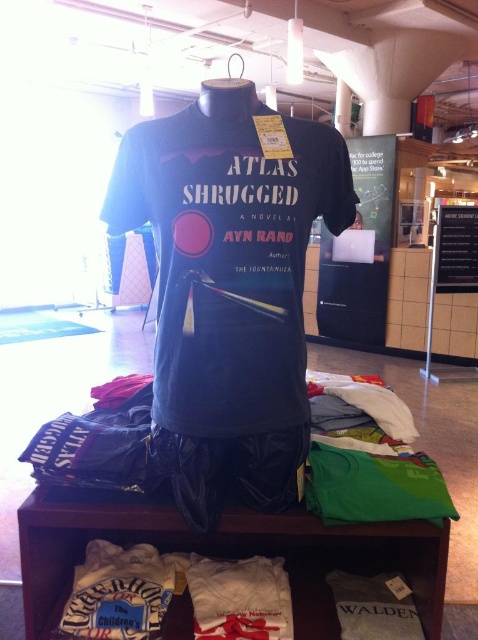
Consider the image. You are standing at point A located at coordinates point A at (304, 131). You need to reach point B, which is 1.11 meters away. Can you walk straight to point B without any obstacles?

Yes, you can walk straight to point B without any obstacles because the distance between point A at (304, 131) and point B is 1.11 meters, and there are no mentioned obstacles in the scene description.